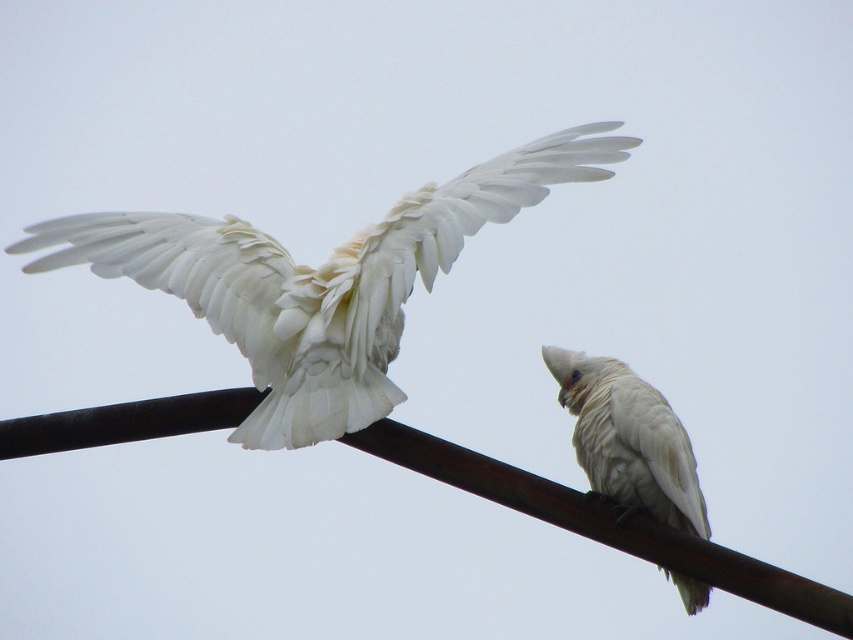
Is point (262, 288) closer to viewer compared to point (216, 422)?

Yes, it is in front of point (216, 422).

Is white feathered bird at upper left in front of rusty metal pole at upper center?

Yes.

Is point (96, 230) positioned in front of point (395, 461)?

No, (96, 230) is further to viewer.

This screenshot has width=853, height=640. Find the location of `white feathered bird at upper left`. white feathered bird at upper left is located at coordinates (318, 280).

Does white feathered bird at upper left appear over white feathered parrot at center?

Indeed, white feathered bird at upper left is positioned over white feathered parrot at center.

Which of these two, white feathered bird at upper left or white feathered parrot at center, stands shorter?

With less height is white feathered parrot at center.

Does point (131, 234) lie behind point (598, 422)?

Yes, point (131, 234) is farther from viewer.

You are a GUI agent. You are given a task and a screenshot of the screen. Output one action in this format:
    pyautogui.click(x=<x>, y=<y>)
    Task: Click on the white feathered bird at upper left
    This screenshot has height=640, width=853.
    Given the screenshot: What is the action you would take?
    pyautogui.click(x=318, y=280)

Is rusty metal pole at upper center smaller than white feathered parrot at center?

No, rusty metal pole at upper center is not smaller than white feathered parrot at center.

Find the location of a particular element. rusty metal pole at upper center is located at coordinates (606, 524).